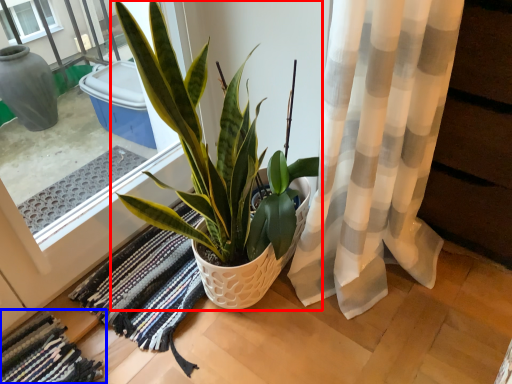
Question: Which of the following is the closest to the observer, houseplant (highlighted by a red box) or bath mat (highlighted by a blue box)?

Choices:
 (A) houseplant
 (B) bath mat

Answer: (A)